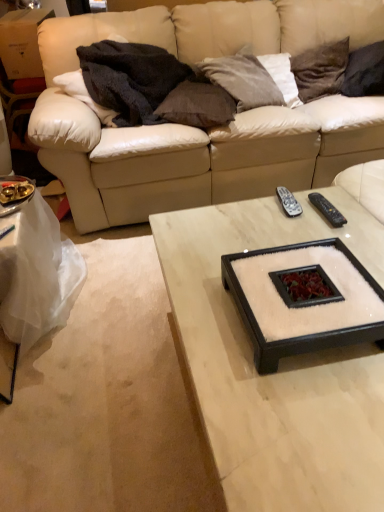
I want to click on free space in front of black plastic remote control at center, the 2th remote control when ordered from right to left, so click(288, 229).